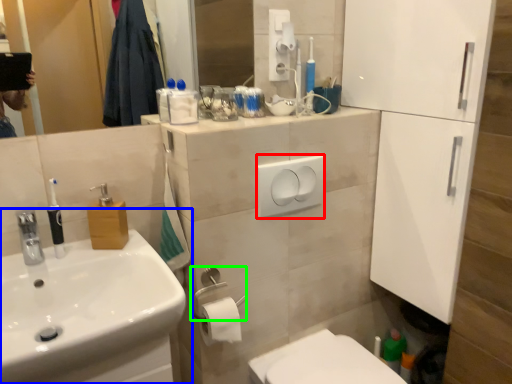
Question: Estimate the real-world distances between objects in this image. Which object is farther from light switch (highlighted by a red box), sink (highlighted by a blue box) or towel bar (highlighted by a green box)?

Choices:
 (A) sink
 (B) towel bar

Answer: (A)